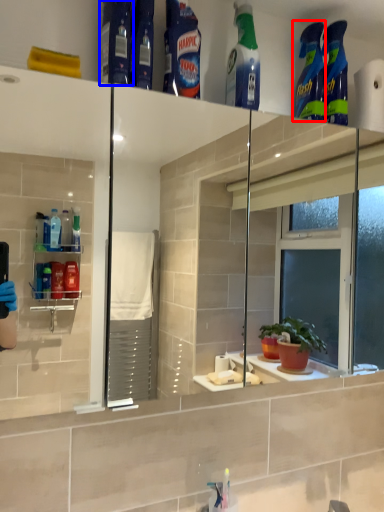
Question: Which of the following is the farthest to the observer, cleaning product (highlighted by a red box) or cleaning product (highlighted by a blue box)?

Choices:
 (A) cleaning product
 (B) cleaning product

Answer: (A)